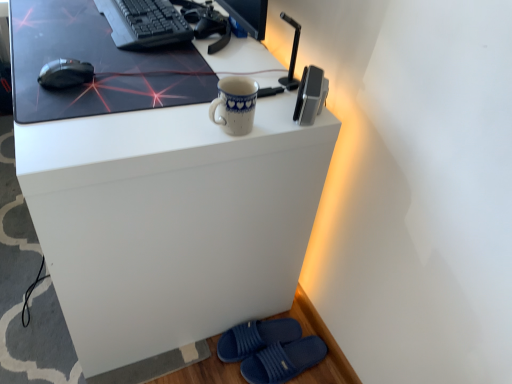
Where is `free spot above white glossy desk at center (from a real-world perspective)`? This screenshot has height=384, width=512. free spot above white glossy desk at center (from a real-world perspective) is located at coordinates (130, 51).